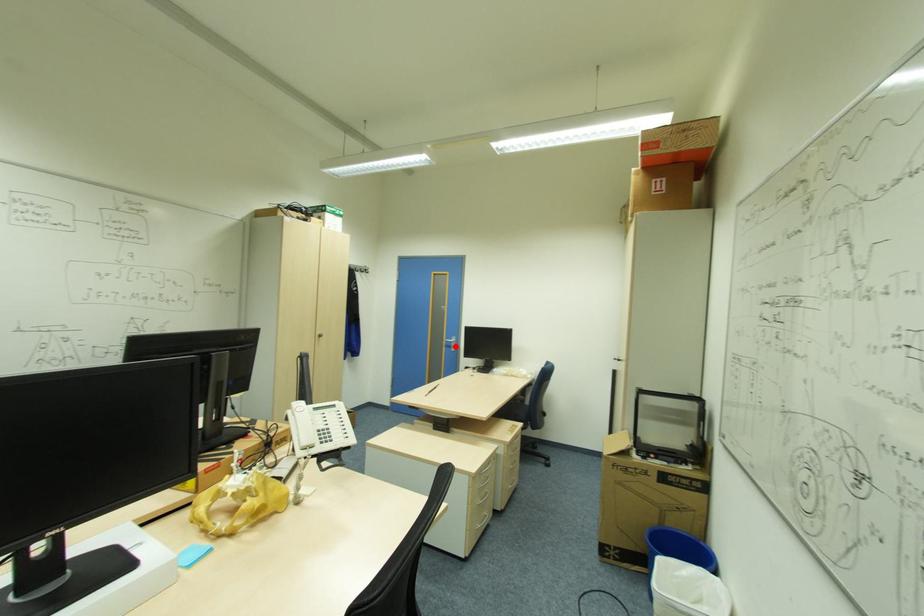
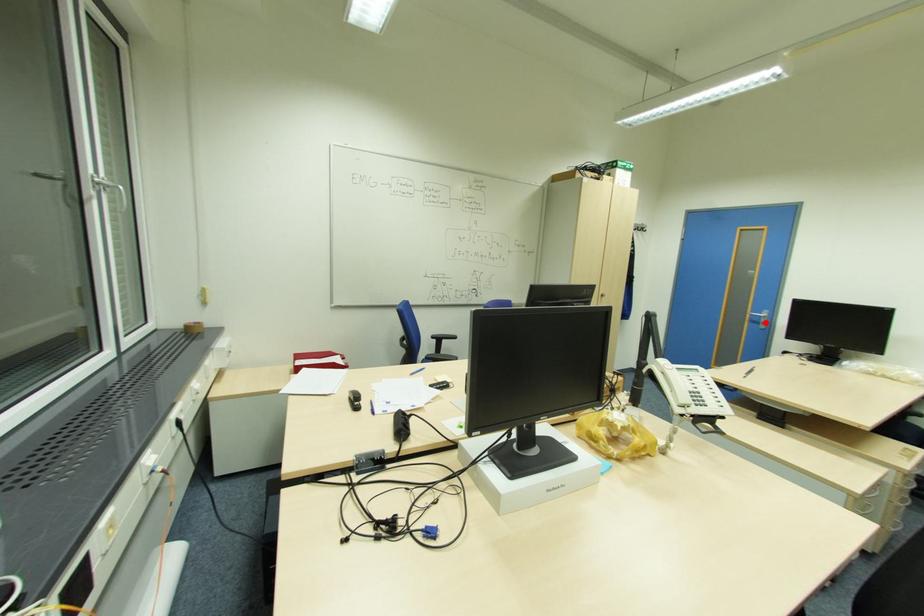
I am providing you with two images of the same scene from different viewpoints. A red point is marked on the first image and another point is marked on the second image. Are the points marked in image1 and image2 representing the same 3D position?

Yes